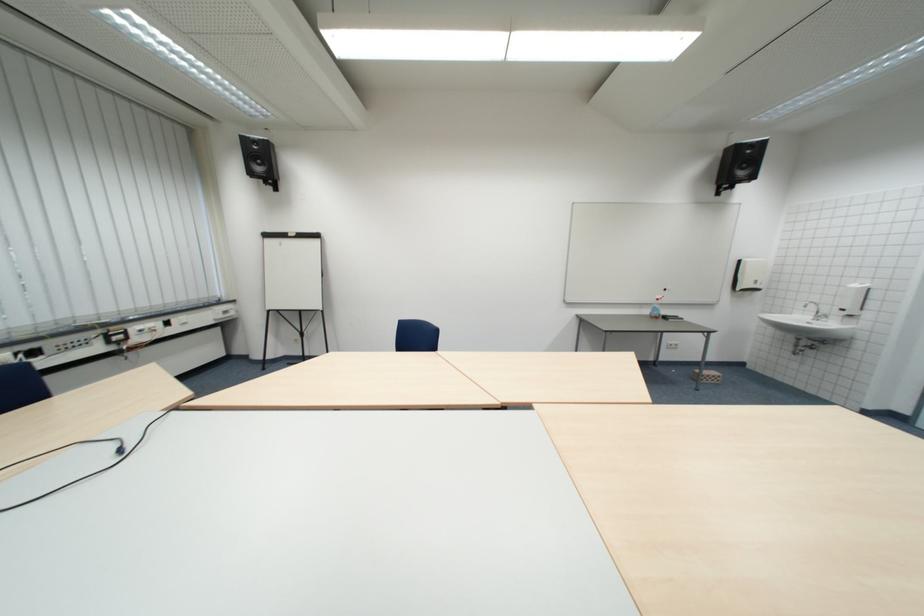
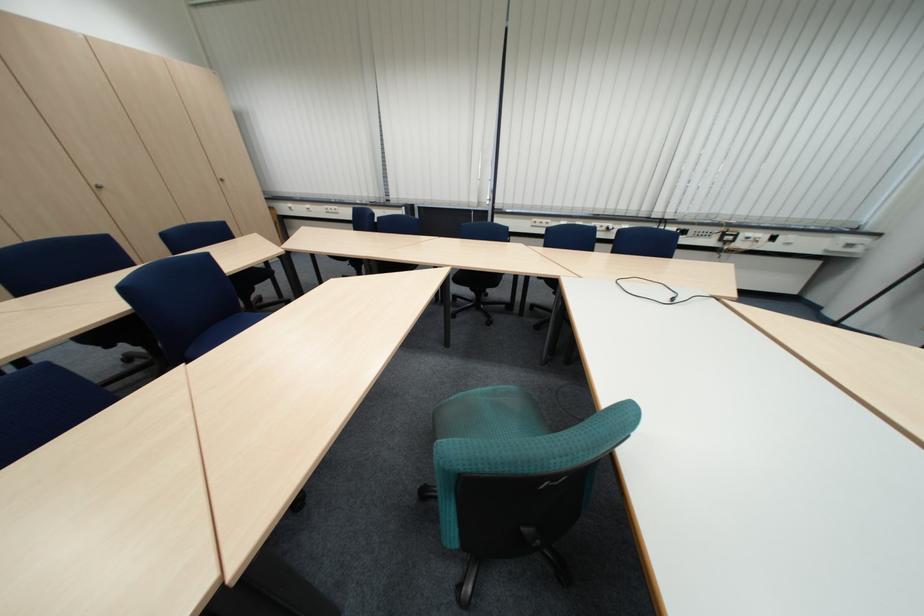
Where in the second image is the point corresponding to the point at 149,330 from the first image?

(759, 235)